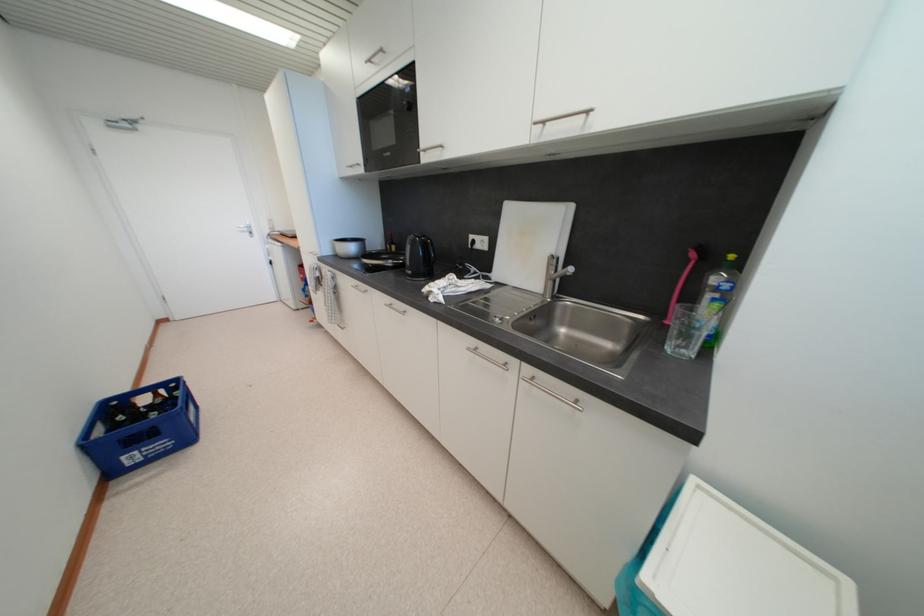
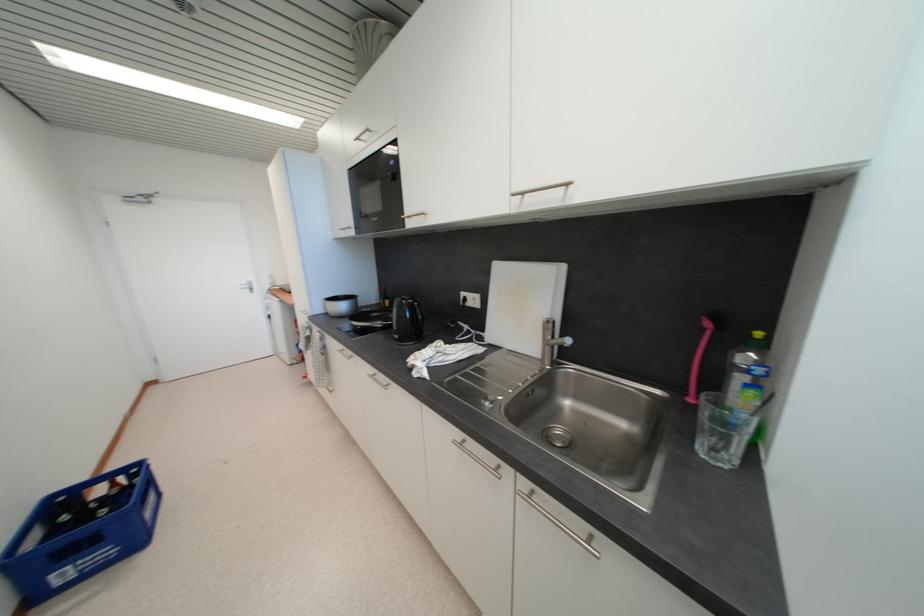
Where in the second image is the point corresponding to (161,398) from the first image?

(118, 487)